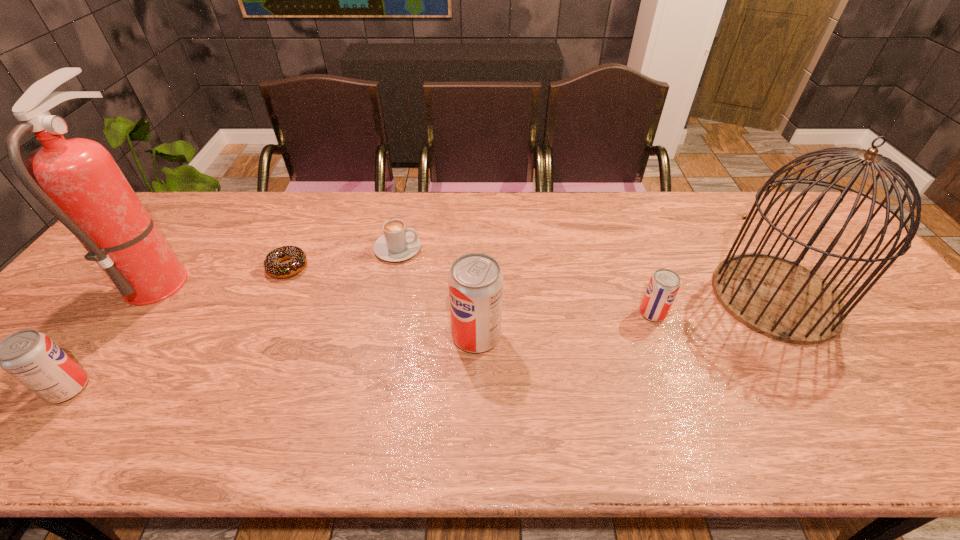
This screenshot has height=540, width=960. In order to click on the leftmost soda in this screenshot , I will do `click(31, 357)`.

Identify the location of the nearest object. (31, 357).

Locate an element on the screen. the fifth object from left to right is located at coordinates (475, 281).

Where is `the third tallest object`? The width and height of the screenshot is (960, 540). the third tallest object is located at coordinates (475, 281).

Image resolution: width=960 pixels, height=540 pixels. I want to click on the sixth object from left to right, so click(x=664, y=284).

Find the location of a particular element. The height and width of the screenshot is (540, 960). the shortest soda is located at coordinates (664, 284).

Image resolution: width=960 pixels, height=540 pixels. Identify the location of the fourth object from left to right. (397, 244).

Where is `the sixth tallest object`? Image resolution: width=960 pixels, height=540 pixels. the sixth tallest object is located at coordinates (397, 244).

The width and height of the screenshot is (960, 540). I want to click on doughnut, so click(x=272, y=266).

At what (x,y) coordinates should I click in order to perform the action: click on the third object from left to right. Please return your answer as a coordinate pair (x, y). The width and height of the screenshot is (960, 540). Looking at the image, I should click on (272, 266).